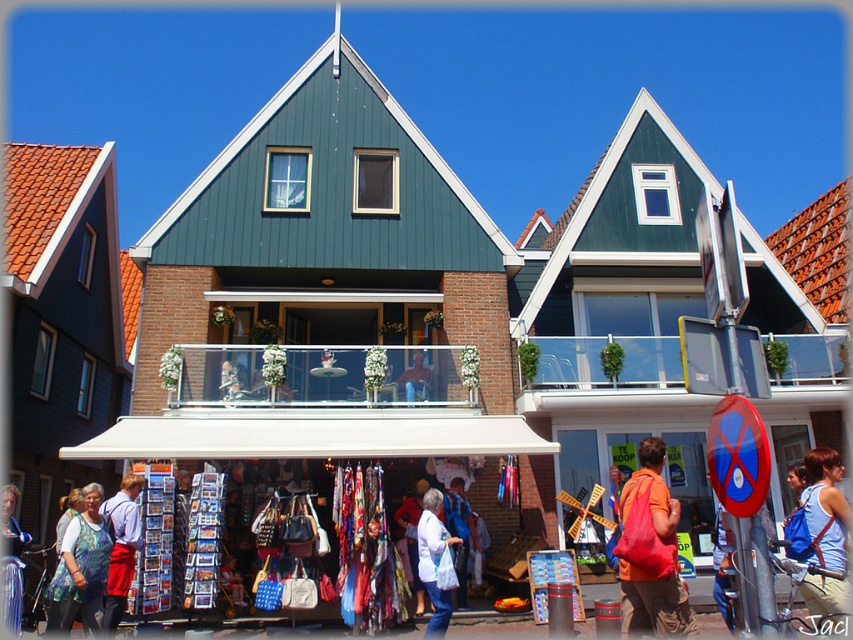
Question: Does denim jacket at lower left appear over leather jacket at center?

Choices:
 (A) no
 (B) yes

Answer: (A)

Question: Is matte orange backpack at center wider than leather jacket at center?

Choices:
 (A) yes
 (B) no

Answer: (B)

Question: Considering the real-world distances, which object is closest to the denim apron at lower left?

Choices:
 (A) leather jacket at center
 (B) matte orange backpack at center

Answer: (A)

Question: Is leather jacket at center further to camera compared to metallic silver purse at lower left?

Choices:
 (A) yes
 (B) no

Answer: (A)

Question: Which object appears farthest from the camera in this image?

Choices:
 (A) leather jacket at center
 (B) light blue tank top at center

Answer: (A)

Question: Considering the real-world distances, which object is farthest from the white fabric bag at center?

Choices:
 (A) leather jacket at center
 (B) denim apron at lower left
 (C) matte orange backpack at center

Answer: (A)